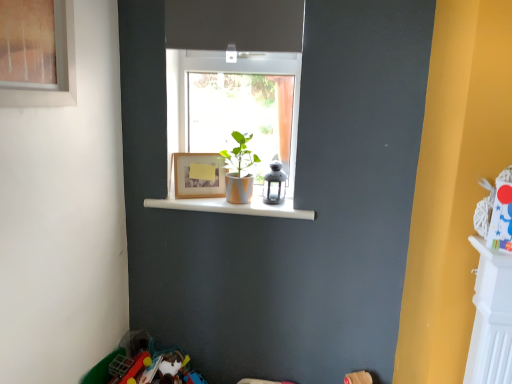
Question: Is wooden frame at center bigger than matte orange pot at center?

Choices:
 (A) yes
 (B) no

Answer: (B)

Question: From the image's perspective, is wooden frame at center beneath matte orange pot at center?

Choices:
 (A) no
 (B) yes

Answer: (B)

Question: Is wooden frame at center positioned in front of matte orange pot at center?

Choices:
 (A) yes
 (B) no

Answer: (B)

Question: Is wooden frame at center far from matte orange pot at center?

Choices:
 (A) yes
 (B) no

Answer: (B)

Question: Is wooden frame at center located outside matte orange pot at center?

Choices:
 (A) no
 (B) yes

Answer: (B)

Question: Does wooden frame at center appear on the left side of matte orange pot at center?

Choices:
 (A) no
 (B) yes

Answer: (B)

Question: Is wooden frame at center positioned beyond the bounds of white glossy shelf at center?

Choices:
 (A) yes
 (B) no

Answer: (A)

Question: Can you confirm if wooden frame at center is wider than white glossy shelf at center?

Choices:
 (A) yes
 (B) no

Answer: (B)

Question: Can you confirm if wooden frame at center is taller than white glossy shelf at center?

Choices:
 (A) no
 (B) yes

Answer: (B)

Question: Is wooden frame at center to the left of white glossy shelf at center from the viewer's perspective?

Choices:
 (A) no
 (B) yes

Answer: (B)

Question: Is wooden frame at center thinner than white glossy shelf at center?

Choices:
 (A) yes
 (B) no

Answer: (A)

Question: Does wooden frame at center have a lesser height compared to white glossy shelf at center?

Choices:
 (A) no
 (B) yes

Answer: (A)

Question: Is white glossy shelf at center positioned in front of wooden frame at center?

Choices:
 (A) yes
 (B) no

Answer: (A)